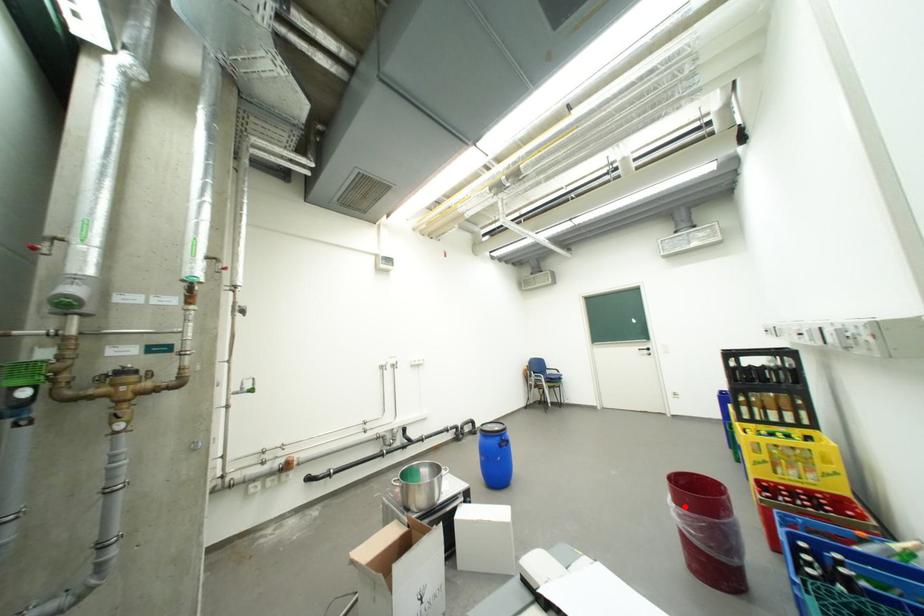
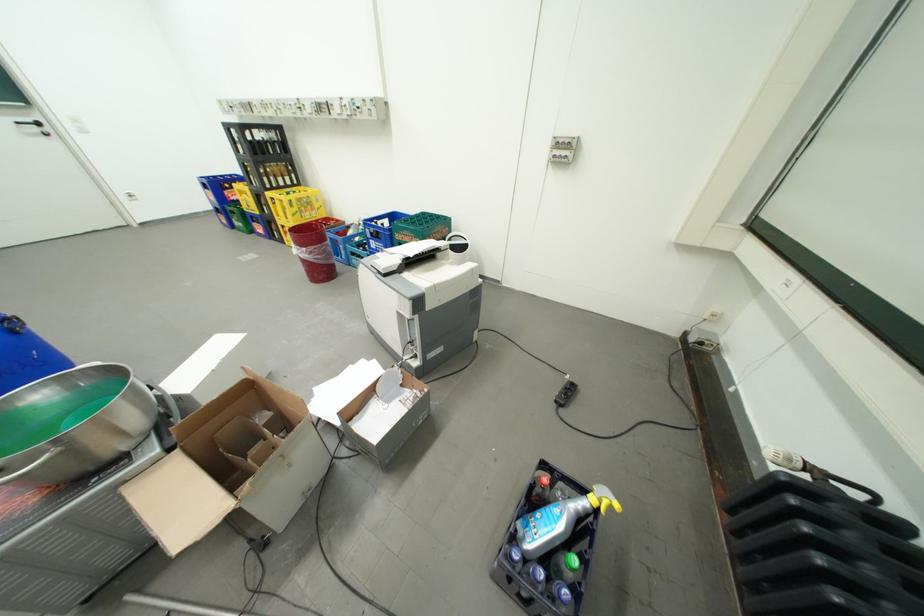
In the second image, find the point that corresponds to the highlighted location in the first image.

(314, 249)